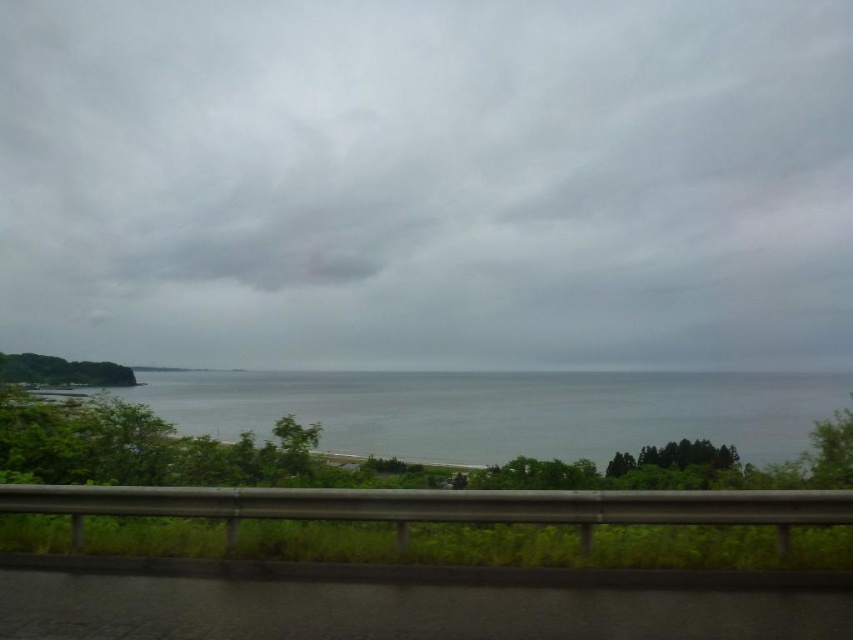
Question: Does gray cloudy sky at upper center have a smaller size compared to gray water at center?

Choices:
 (A) yes
 (B) no

Answer: (B)

Question: Is gray cloudy sky at upper center further to camera compared to gray water at center?

Choices:
 (A) yes
 (B) no

Answer: (A)

Question: Which object is farther from the camera taking this photo?

Choices:
 (A) gray cloudy sky at upper center
 (B) gray water at center

Answer: (A)

Question: Can you confirm if gray cloudy sky at upper center is positioned above gray water at center?

Choices:
 (A) yes
 (B) no

Answer: (A)

Question: Which of the following is the farthest from the observer?

Choices:
 (A) gray cloudy sky at upper center
 (B) gray water at center

Answer: (A)